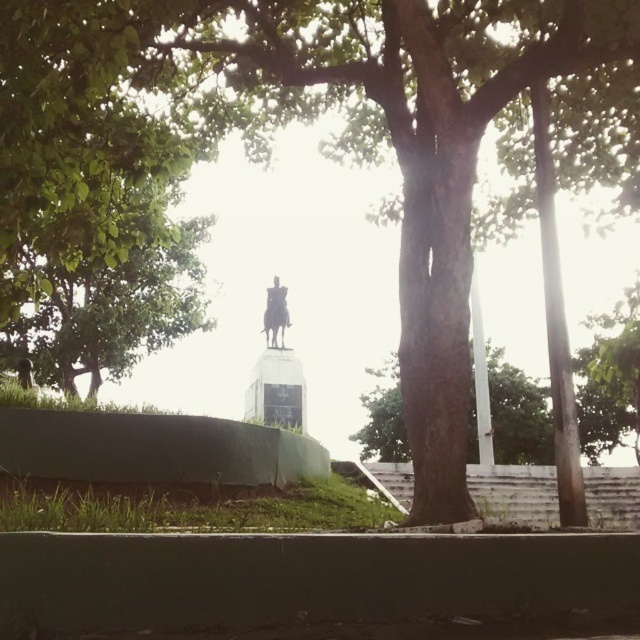
Question: Which of these objects is positioned closest to the metallic statue at center?

Choices:
 (A) white concrete stairs at lower center
 (B) brown rough tree trunk at center

Answer: (A)

Question: Does white concrete stairs at lower center have a larger size compared to metallic statue at center?

Choices:
 (A) yes
 (B) no

Answer: (B)

Question: Does brown rough tree trunk at center lie behind metallic statue at center?

Choices:
 (A) no
 (B) yes

Answer: (B)

Question: Which object is closer to the camera taking this photo?

Choices:
 (A) metallic statue at center
 (B) white concrete stairs at lower center
 (C) brown rough tree trunk at center

Answer: (B)

Question: Estimate the real-world distances between objects in this image. Which object is closer to the white concrete stairs at lower center?

Choices:
 (A) metallic statue at center
 (B) brown rough tree trunk at center

Answer: (A)

Question: From the image, what is the correct spatial relationship of brown rough tree trunk at center in relation to metallic statue at center?

Choices:
 (A) left
 (B) right

Answer: (B)